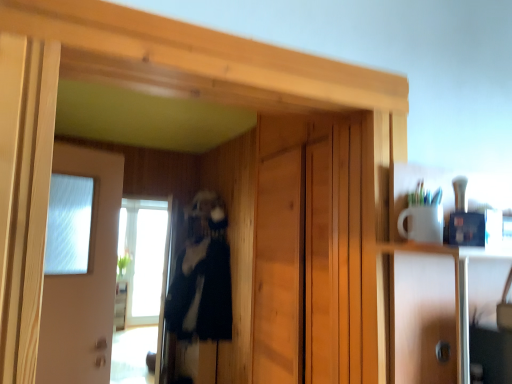
You are a GUI agent. You are given a task and a screenshot of the screen. Output one action in this format:
    pyautogui.click(x=<x>, y=<y>)
    Task: Click on the transparent glass window at center
    
    Given the screenshot: What is the action you would take?
    pyautogui.click(x=149, y=262)

What do you see at coordinates (200, 296) in the screenshot?
I see `black fuzzy coat at center` at bounding box center [200, 296].

This screenshot has height=384, width=512. I want to click on transparent glass screen door at left, so click(x=140, y=286).

Locate an element on the screen. Image resolution: width=512 pixels, height=384 pixels. transparent glass window at center is located at coordinates (149, 262).

Considering the positions of objects white glossy door at left and black fuzzy coat at center in the image provided, who is more to the left, white glossy door at left or black fuzzy coat at center?

white glossy door at left is more to the left.

Is white glossy door at left not close to black fuzzy coat at center?

That's right, there is a large distance between white glossy door at left and black fuzzy coat at center.

From a real-world perspective, which object stands above the other?

white glossy door at left is physically above.

Considering the sizes of white glossy door at left and black fuzzy coat at center in the image, is white glossy door at left bigger or smaller than black fuzzy coat at center?

Considering their sizes, white glossy door at left takes up less space than black fuzzy coat at center.

From the image's perspective, is transparent glass screen door at left on top of black fuzzy coat at center?

Incorrect, from the image's perspective, transparent glass screen door at left is lower than black fuzzy coat at center.

Which object is closer to the camera, transparent glass screen door at left or black fuzzy coat at center?

Positioned in front is black fuzzy coat at center.

Is transparent glass screen door at left surrounding black fuzzy coat at center?

No.

I want to click on screen door below the black fuzzy coat at center (from a real-world perspective), so click(x=140, y=286).

Based on the photo, from a real-world perspective, relative to white glossy door at left, is transparent glass window at center vertically above or below?

transparent glass window at center is situated lower than white glossy door at left in the real world.

Looking at this image, from the image's perspective, which one is positioned lower, transparent glass window at center or white glossy door at left?

transparent glass window at center appears lower in the image.

The height and width of the screenshot is (384, 512). I want to click on window that appears on the left of white glossy door at left, so click(149, 262).

From the picture: Which of these two, transparent glass window at center or white glossy door at left, is wider?

transparent glass window at center is wider.

Is white glossy door at left not close to transparent glass window at center?

Absolutely, white glossy door at left is distant from transparent glass window at center.

Can you tell me how much white glossy door at left and transparent glass window at center differ in facing direction?

The angular difference between white glossy door at left and transparent glass window at center is 27.3 degrees.

Is point (105, 193) farther from camera compared to point (134, 302)?

No, (105, 193) is in front of (134, 302).

From a real-world perspective, is white glossy door at left positioned over transparent glass window at center based on gravity?

Yes, from a real-world perspective, white glossy door at left is on top of transparent glass window at center.

This screenshot has width=512, height=384. I want to click on screen door above the transparent glass window at center (from the image's perspective), so [140, 286].

Is transparent glass window at center outside of transparent glass screen door at left?

That's correct, transparent glass window at center is outside of transparent glass screen door at left.

Is transparent glass window at center next to transparent glass screen door at left?

No, transparent glass window at center is not in contact with transparent glass screen door at left.

Considering the sizes of transparent glass window at center and transparent glass screen door at left in the image, is transparent glass window at center bigger or smaller than transparent glass screen door at left?

Considering their sizes, transparent glass window at center takes up less space than transparent glass screen door at left.

Is white glossy door at left inside or outside of transparent glass screen door at left?

white glossy door at left is not enclosed by transparent glass screen door at left.

Identify the location of door above the transparent glass screen door at left (from a real-world perspective). The height and width of the screenshot is (384, 512). (84, 280).

Does white glossy door at left come behind transparent glass screen door at left?

That is False.

Can you tell me how much white glossy door at left and transparent glass screen door at left differ in facing direction?

The angle between the facing direction of white glossy door at left and the facing direction of transparent glass screen door at left is 28.7 degrees.

Is black fuzzy coat at center facing towards white glossy door at left?

No.

Considering the positions of point (220, 338) and point (95, 315), is point (220, 338) closer or farther from the camera than point (95, 315)?

Point (220, 338) is farther from the camera than point (95, 315).

Choose the correct answer: Is black fuzzy coat at center inside white glossy door at left or outside it?

black fuzzy coat at center is outside white glossy door at left.

Identify the location of door that appears on the left of black fuzzy coat at center. (84, 280).

The image size is (512, 384). Identify the location of screen door behind the black fuzzy coat at center. (140, 286).

Based on their spatial positions, is transparent glass window at center or transparent glass screen door at left further from black fuzzy coat at center?

Among the two, transparent glass window at center is located further to black fuzzy coat at center.

Estimate the real-world distances between objects in this image. Which object is further from transparent glass screen door at left, transparent glass window at center or white glossy door at left?

white glossy door at left is positioned further to the anchor transparent glass screen door at left.

Looking at the image, which one is located further to transparent glass window at center, white glossy door at left or black fuzzy coat at center?

Among the two, white glossy door at left is located further to transparent glass window at center.

Estimate the real-world distances between objects in this image. Which object is closer to transparent glass screen door at left, white glossy door at left or transparent glass window at center?

Among the two, transparent glass window at center is located nearer to transparent glass screen door at left.

Which object lies nearer to the anchor point transparent glass window at center, white glossy door at left or transparent glass screen door at left?

The object closer to transparent glass window at center is transparent glass screen door at left.

Considering their positions, is transparent glass screen door at left positioned further to white glossy door at left than transparent glass window at center?

Based on the image, transparent glass window at center appears to be further to white glossy door at left.

Estimate the real-world distances between objects in this image. Which object is further from transparent glass window at center, black fuzzy coat at center or white glossy door at left?

Based on the image, white glossy door at left appears to be further to transparent glass window at center.

From the image, which object appears to be nearer to white glossy door at left, transparent glass screen door at left or black fuzzy coat at center?

black fuzzy coat at center is closer to white glossy door at left.

I want to click on screen door between black fuzzy coat at center and transparent glass window at center in the front-back direction, so click(x=140, y=286).

The width and height of the screenshot is (512, 384). What are the coordinates of `screen door between white glossy door at left and transparent glass window at center from front to back` in the screenshot? It's located at (140, 286).

At what (x,y) coordinates should I click in order to perform the action: click on clothing between white glossy door at left and transparent glass screen door at left in the front-back direction. Please return your answer as a coordinate pair (x, y). Image resolution: width=512 pixels, height=384 pixels. Looking at the image, I should click on (200, 296).

What are the coordinates of `clothing between white glossy door at left and transparent glass window at center along the z-axis` in the screenshot? It's located at (200, 296).